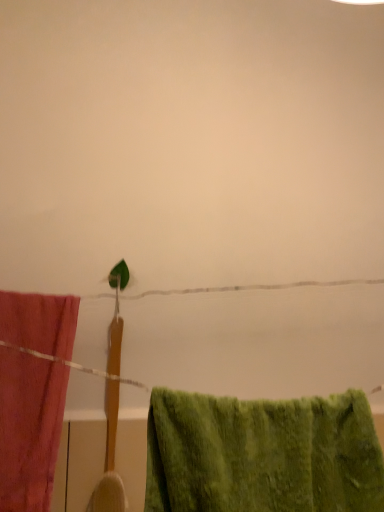
Question: From a real-world perspective, is matte pink towel at left, marked as the 2th towel in a right-to-left arrangement, on top of green fuzzy towel at lower right, the first towel from the right?

Choices:
 (A) no
 (B) yes

Answer: (B)

Question: Is matte pink towel at left, marked as the 2th towel in a right-to-left arrangement, smaller than green fuzzy towel at lower right, which is the second towel from back to front?

Choices:
 (A) yes
 (B) no

Answer: (A)

Question: Is matte pink towel at left, which is the first towel in left-to-right order, closer to the viewer compared to green fuzzy towel at lower right, positioned as the 2th towel in left-to-right order?

Choices:
 (A) no
 (B) yes

Answer: (A)

Question: Is matte pink towel at left, which is the first towel in left-to-right order, further to the viewer compared to green fuzzy towel at lower right, which ranks as the first towel in front-to-back order?

Choices:
 (A) yes
 (B) no

Answer: (A)

Question: Is matte pink towel at left, the 1th towel in the back-to-front sequence, next to green fuzzy towel at lower right, positioned as the 2th towel in left-to-right order, and touching it?

Choices:
 (A) yes
 (B) no

Answer: (B)

Question: Are green fuzzy towel at lower right, which ranks as the first towel in front-to-back order, and matte pink towel at left, marked as the 2th towel in a right-to-left arrangement, beside each other?

Choices:
 (A) yes
 (B) no

Answer: (B)

Question: Is green fuzzy towel at lower right, which ranks as the first towel in front-to-back order, thinner than matte pink towel at left, acting as the 2th towel starting from the front?

Choices:
 (A) yes
 (B) no

Answer: (B)

Question: Is green fuzzy towel at lower right, which ranks as the first towel in front-to-back order, smaller than matte pink towel at left, the 1th towel in the back-to-front sequence?

Choices:
 (A) no
 (B) yes

Answer: (A)

Question: Can you confirm if green fuzzy towel at lower right, which is the second towel from back to front, is shorter than matte pink towel at left, the 1th towel in the back-to-front sequence?

Choices:
 (A) no
 (B) yes

Answer: (B)

Question: From a real-world perspective, is green fuzzy towel at lower right, which is the second towel from back to front, on top of matte pink towel at left, the 1th towel in the back-to-front sequence?

Choices:
 (A) yes
 (B) no

Answer: (B)

Question: From the image's perspective, is green fuzzy towel at lower right, which is the second towel from back to front, located beneath matte pink towel at left, which is the first towel in left-to-right order?

Choices:
 (A) yes
 (B) no

Answer: (A)

Question: Visually, is green fuzzy towel at lower right, positioned as the 2th towel in left-to-right order, positioned to the left or to the right of matte pink towel at left, which is the first towel in left-to-right order?

Choices:
 (A) right
 (B) left

Answer: (A)